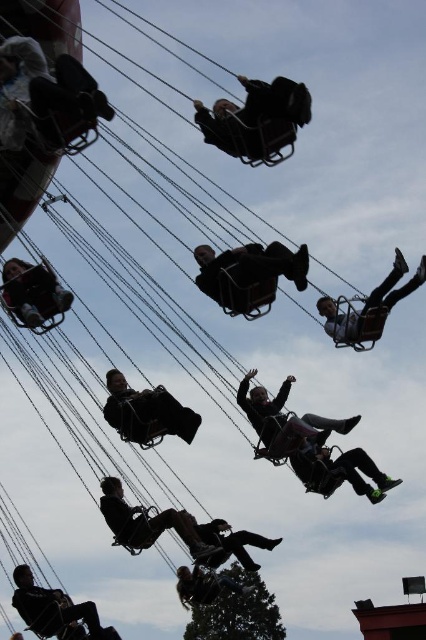
Question: Among these objects, which one is farthest from the camera?

Choices:
 (A) matte black person at left
 (B) matte black helmet at center
 (C) silvery metallic helmet at center
 (D) black matte swing at center

Answer: (C)

Question: Does matte black swing at center appear on the right side of black leather jacket at lower left?

Choices:
 (A) yes
 (B) no

Answer: (A)

Question: Where is matte black person at left located in relation to silvery metallic helmet at center in the image?

Choices:
 (A) below
 (B) above

Answer: (B)

Question: Does dark gray fabric seat at center have a larger size compared to matte black person at center?

Choices:
 (A) no
 (B) yes

Answer: (A)

Question: Which point appears farthest from the camera in this image?

Choices:
 (A) tap(279, 144)
 (B) tap(181, 586)
 (C) tap(28, 602)
 (D) tap(28, 262)

Answer: (B)

Question: Which point appears farthest from the camera in this image?

Choices:
 (A) (123, 426)
 (B) (213, 522)

Answer: (B)